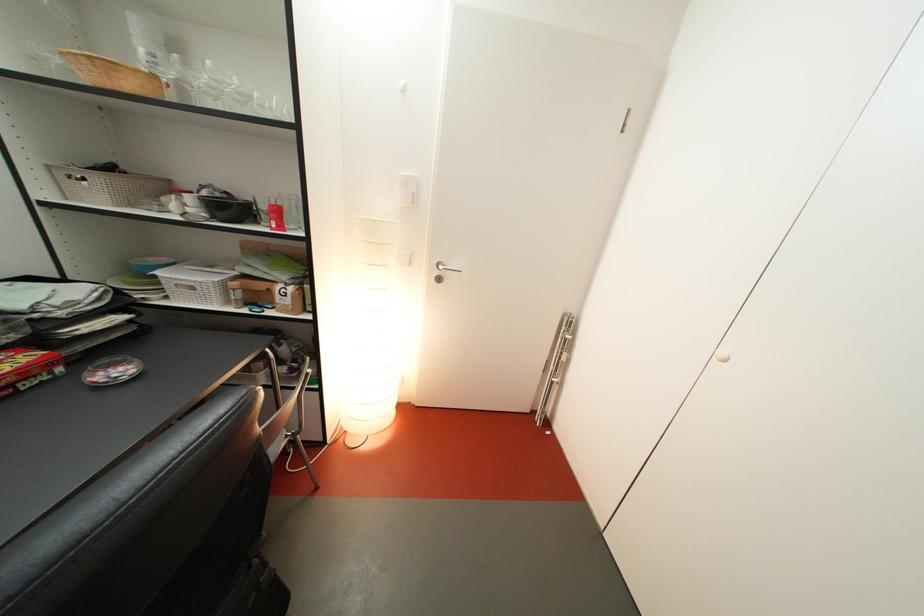
This screenshot has width=924, height=616. I want to click on dark bowl, so click(224, 205).